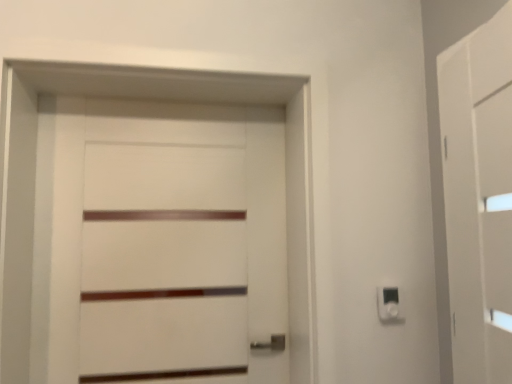
Question: From a real-world perspective, is white plastic light switch at lower right positioned above or below white matte door at center?

Choices:
 (A) below
 (B) above

Answer: (A)

Question: Looking at their shapes, would you say white plastic light switch at lower right is wider or thinner than white matte door at center?

Choices:
 (A) thin
 (B) wide

Answer: (A)

Question: Estimate the real-world distances between objects in this image. Which object is farther from the white plastic light switch at lower right?

Choices:
 (A) white matte door at center
 (B) white matte barn door at right

Answer: (A)

Question: Based on their relative distances, which object is nearer to the white plastic light switch at lower right?

Choices:
 (A) white matte door at center
 (B) white matte barn door at right

Answer: (B)